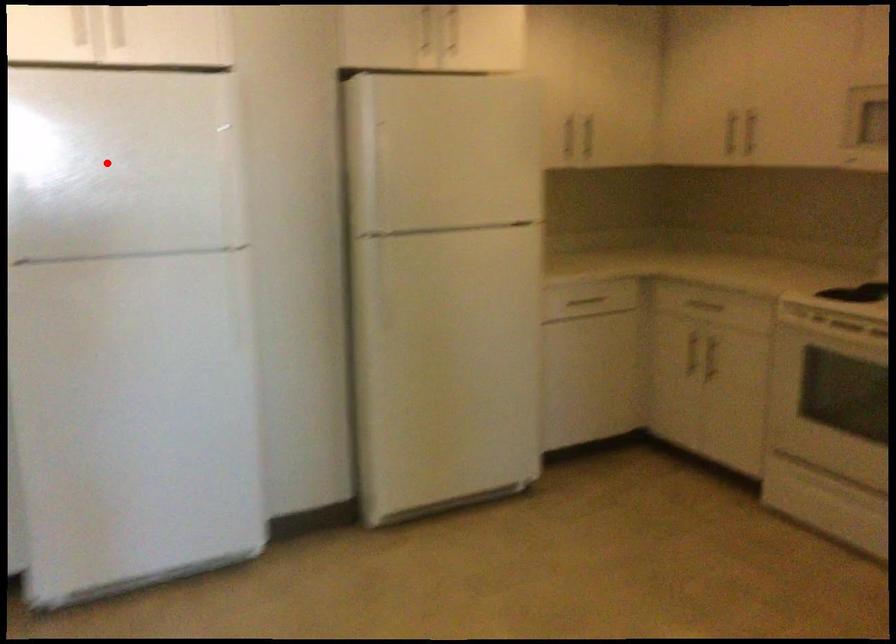
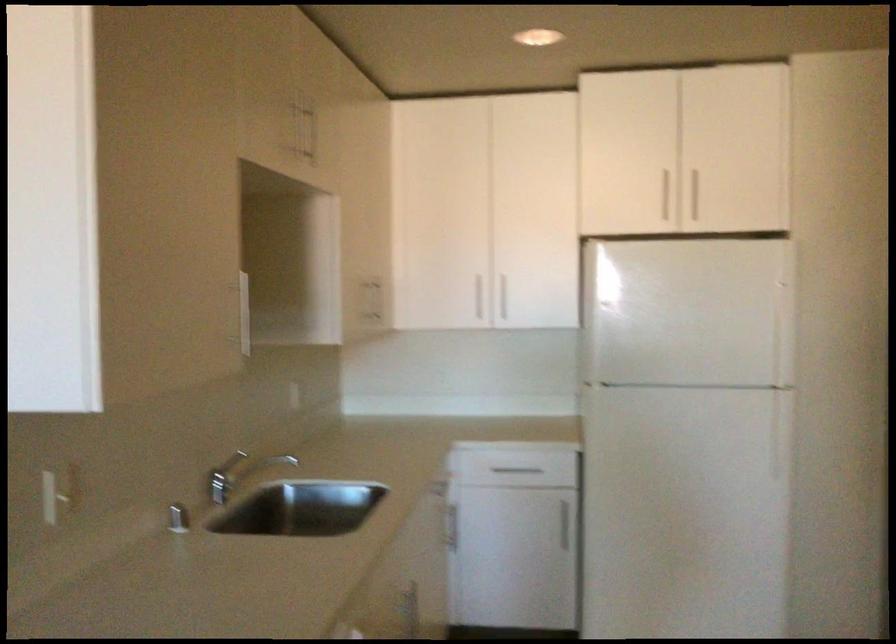
Question: I am providing you with two images of the same scene from different viewpoints. A red point is shown in image1. For the corresponding object point in image2, is it positioned nearer or farther from the camera?

Choices:
 (A) Nearer
 (B) Farther

Answer: (B)